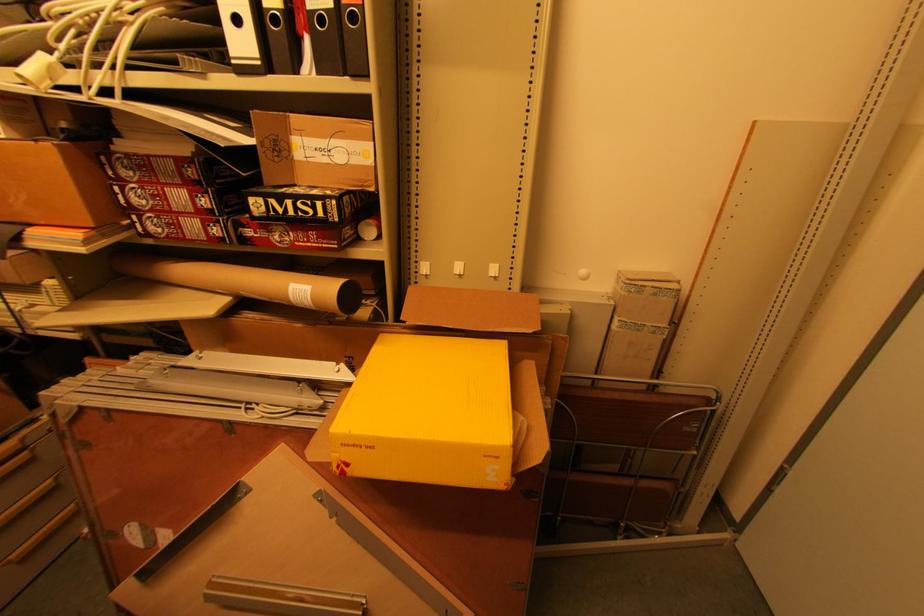
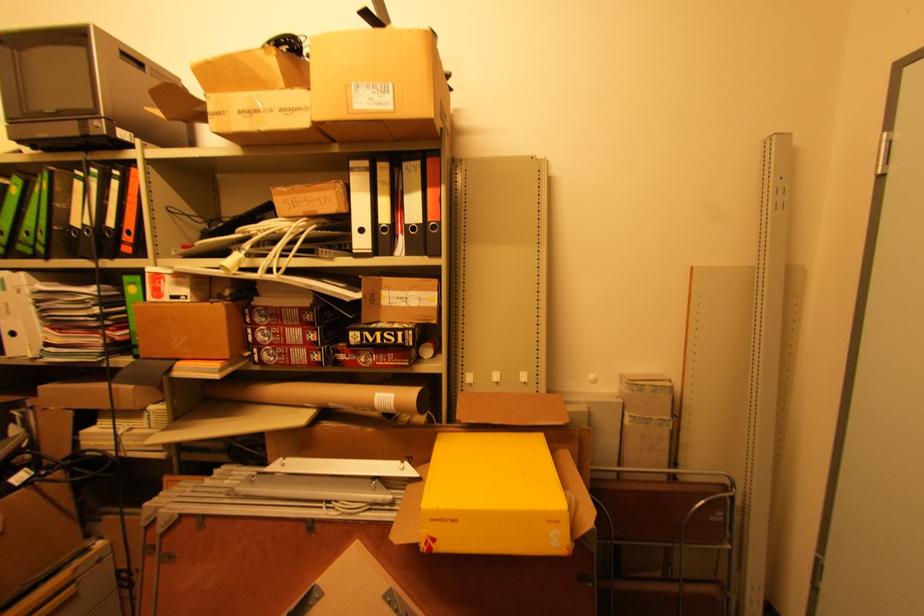
Find the pixel in the second image that matches point (287, 154) in the first image.

(380, 302)